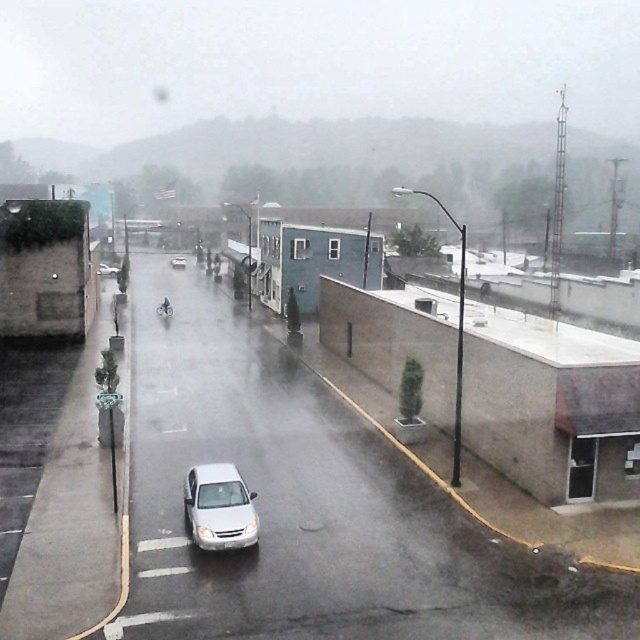
Question: Does white glossy sedan at center lie behind white matte car at center?

Choices:
 (A) no
 (B) yes

Answer: (A)

Question: Considering the real-world distances, which object is farthest from the white matte sedan at center?

Choices:
 (A) white glossy sedan at center
 (B) white matte car at center

Answer: (A)

Question: In this image, where is white glossy sedan at center located relative to white matte sedan at center?

Choices:
 (A) right
 (B) left

Answer: (A)

Question: Considering the relative positions of white matte sedan at center and white matte car at center in the image provided, where is white matte sedan at center located with respect to white matte car at center?

Choices:
 (A) below
 (B) above

Answer: (A)

Question: Among these objects, which one is nearest to the camera?

Choices:
 (A) white matte sedan at center
 (B) white glossy sedan at center
 (C) white matte car at center

Answer: (B)

Question: Which of the following is the closest to the observer?

Choices:
 (A) white matte sedan at center
 (B) white matte car at center
 (C) white glossy sedan at center

Answer: (C)